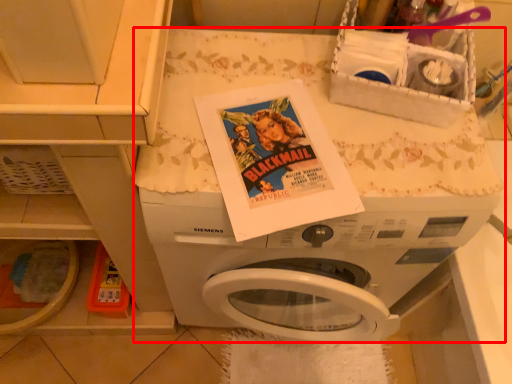
Question: From the image's perspective, where is washing machine (annotated by the red box) located in relation to basket in the image?

Choices:
 (A) below
 (B) above

Answer: (A)